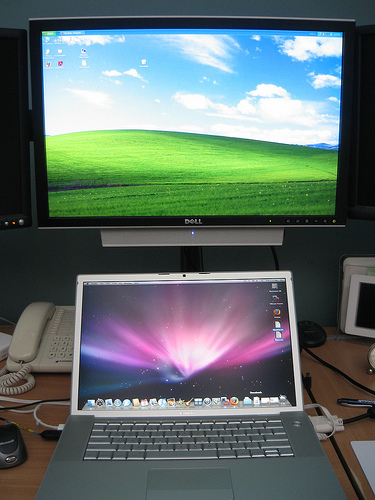
At what (x,y) coordinates should I click in order to perform the action: click on wired mouse. Please return your answer as a coordinate pair (x, y). The image size is (375, 500). Looking at the image, I should click on (16, 445).